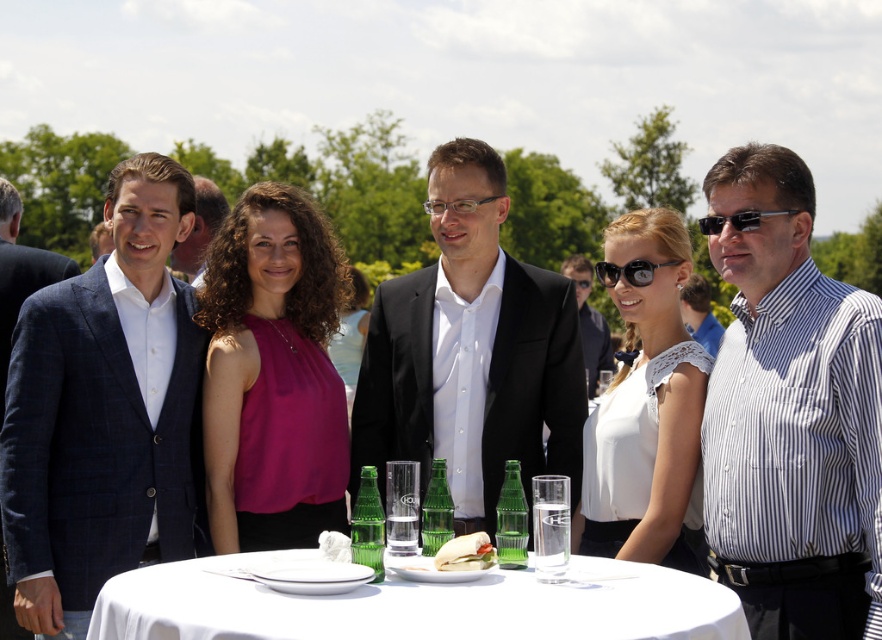
Who is positioned more to the right, pink satin blouse at center or white cloth table at center?

From the viewer's perspective, white cloth table at center appears more on the right side.

Does pink satin blouse at center appear on the left side of white cloth table at center?

Indeed, pink satin blouse at center is positioned on the left side of white cloth table at center.

This screenshot has height=640, width=882. Find the location of `pink satin blouse at center`. pink satin blouse at center is located at coordinates [x=273, y=374].

Between black plastic sunglasses at center and black plastic sunglasses at right, which one appears on the right side from the viewer's perspective?

black plastic sunglasses at right

Can you confirm if black plastic sunglasses at center is thinner than black plastic sunglasses at right?

Yes, black plastic sunglasses at center is thinner than black plastic sunglasses at right.

Locate an element on the screen. This screenshot has width=882, height=640. black plastic sunglasses at center is located at coordinates (629, 272).

Is point (245, 612) positioned after point (587, 472)?

No, (245, 612) is closer to viewer.

Which is in front, point (370, 584) or point (679, 266)?

Point (370, 584) is more forward.

Locate an element on the screen. white cloth table at center is located at coordinates (416, 604).

The width and height of the screenshot is (882, 640). I want to click on white cloth table at center, so click(416, 604).